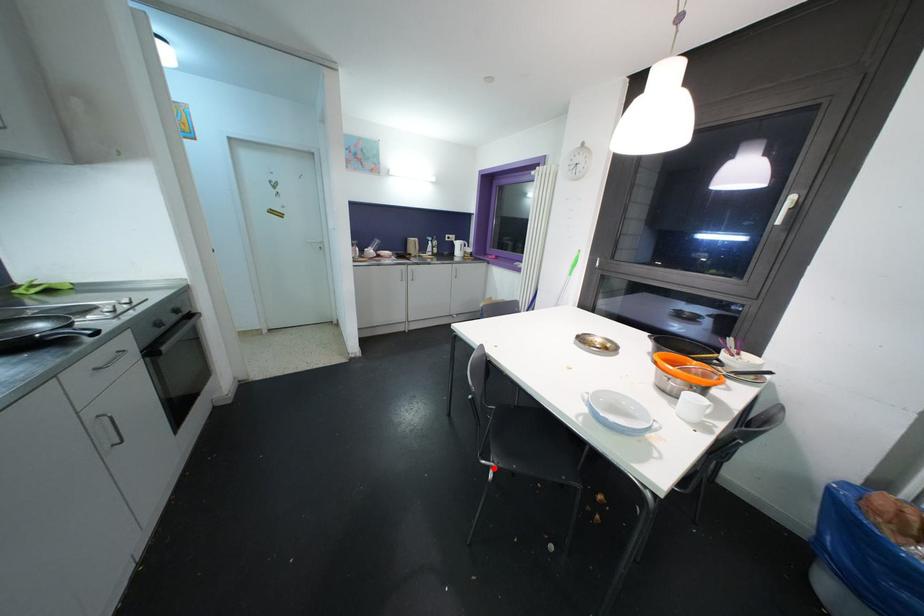
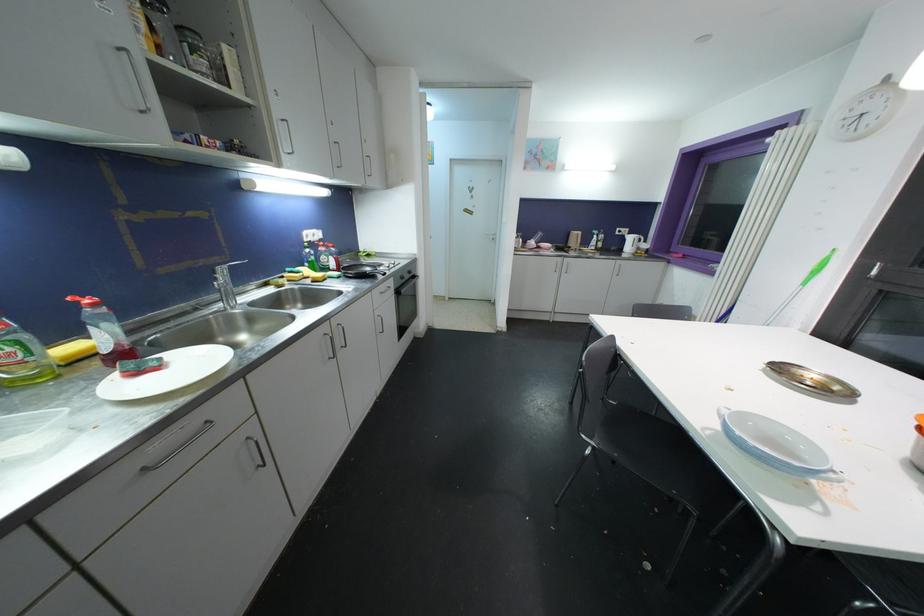
Find the pixel in the second image that matches the highlighted location in the first image.

(593, 446)